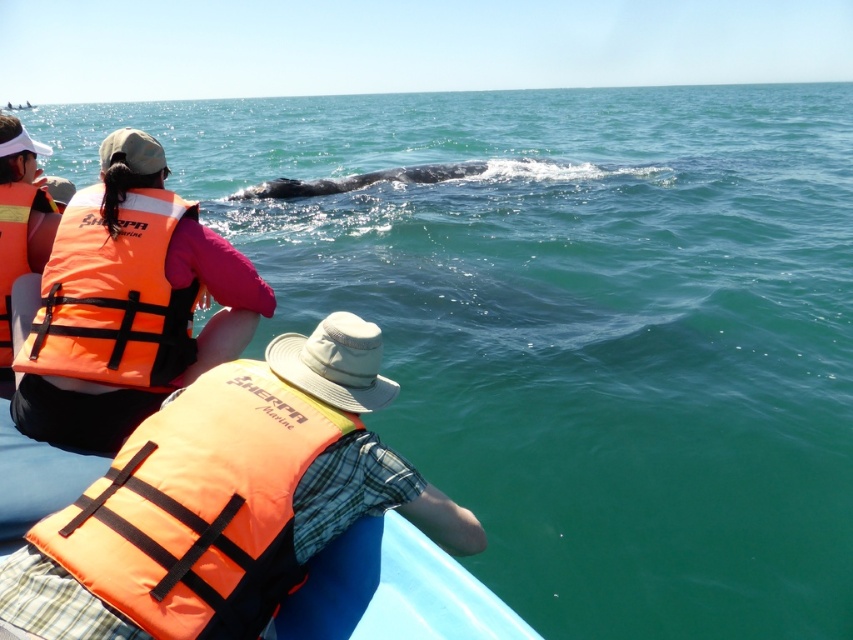
Question: Considering the relative positions of orange life vest at left and orange life jacket at left in the image provided, where is orange life vest at left located with respect to orange life jacket at left?

Choices:
 (A) right
 (B) left

Answer: (A)

Question: Which of these objects is positioned closest to the orange life jacket at left?

Choices:
 (A) orange fabric life jacket at left
 (B) orange life vest at center

Answer: (A)

Question: Which is nearer to the orange fabric life jacket at left?

Choices:
 (A) orange life vest at left
 (B) orange life vest at center
 (C) orange life jacket at left

Answer: (A)

Question: Is orange life vest at left in front of orange life vest at center?

Choices:
 (A) yes
 (B) no

Answer: (B)

Question: Can you confirm if orange fabric life jacket at left is bigger than orange life jacket at left?

Choices:
 (A) yes
 (B) no

Answer: (A)

Question: Which object is the closest to the orange life jacket at left?

Choices:
 (A) orange fabric life jacket at left
 (B) orange life vest at center

Answer: (A)